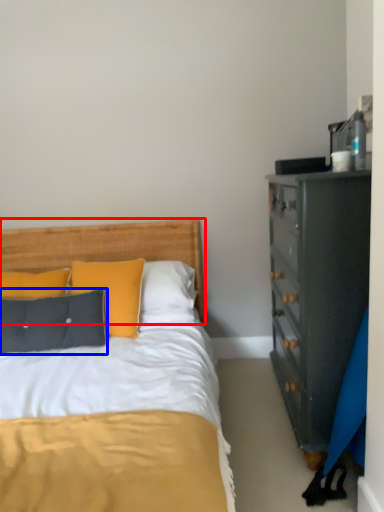
Question: Which object is further to the camera taking this photo, headboard (highlighted by a red box) or pillow (highlighted by a blue box)?

Choices:
 (A) headboard
 (B) pillow

Answer: (A)